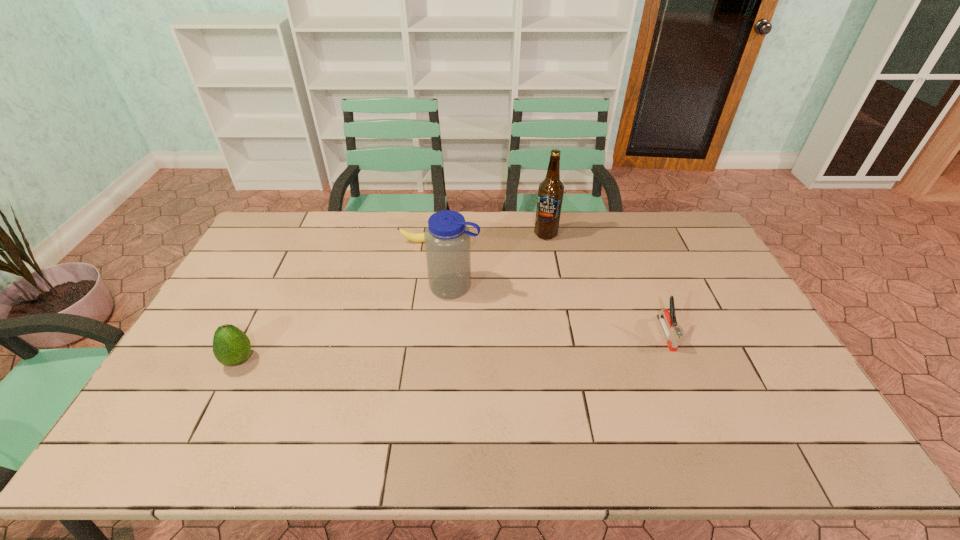
At what (x,y) coordinates should I click in order to perform the action: click on free space on the desktop that is between the avocado and the fourth tallest object and is positioned on the upward curve of the banana. Please return your answer as a coordinate pair (x, y). The height and width of the screenshot is (540, 960). Looking at the image, I should click on (438, 348).

What are the coordinates of `vacant space on the desktop that is between the leftmost object and the rightmost object and is positioned with a carrying loop on the side of the water bottle` in the screenshot? It's located at (405, 350).

You are a GUI agent. You are given a task and a screenshot of the screen. Output one action in this format:
    pyautogui.click(x=<x>, y=<y>)
    Task: Click on the free space on the desktop that is between the avocado and the rightmost object and is positioned on the label of the beer bottle
    
    Given the screenshot: What is the action you would take?
    pyautogui.click(x=450, y=347)